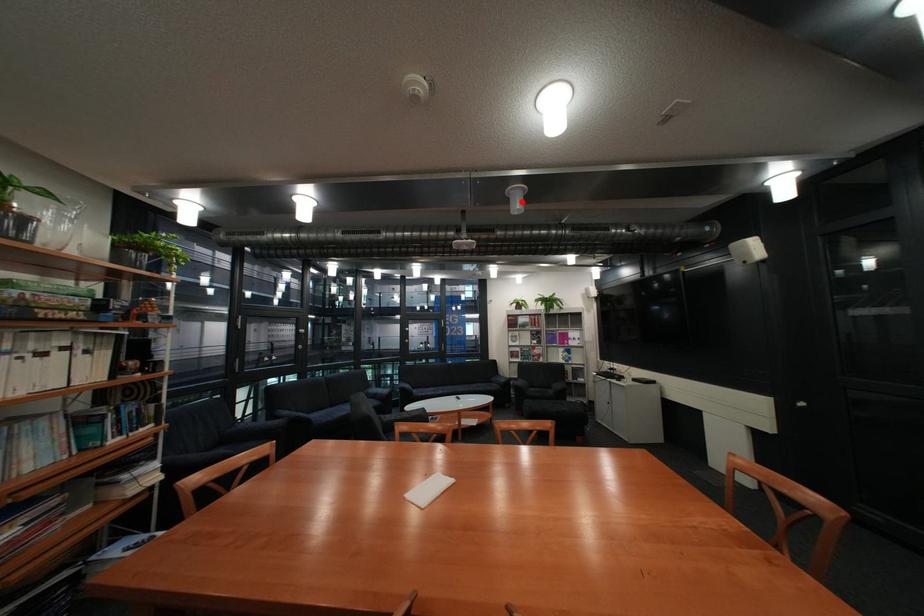
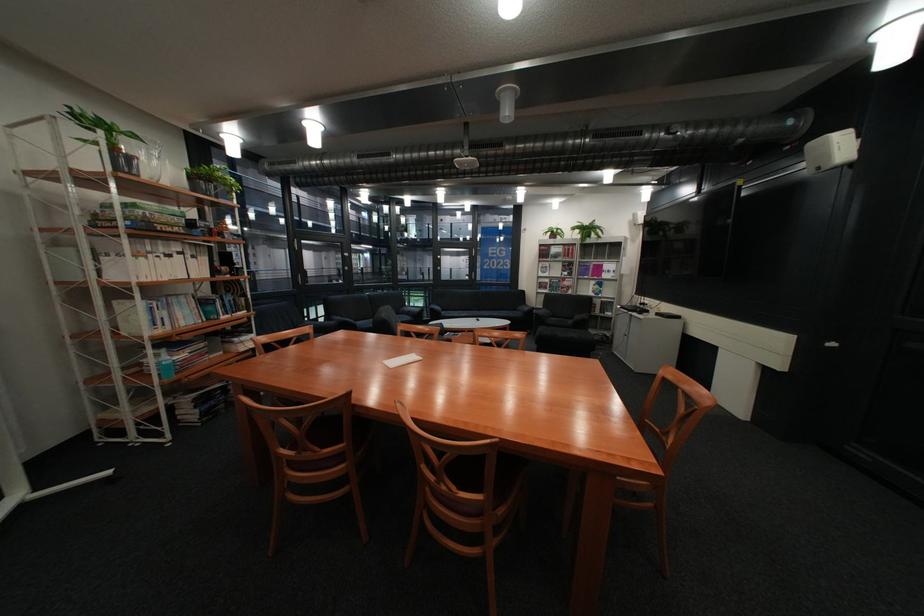
Find the pixel in the second image that matches the highlighted location in the first image.

(513, 108)